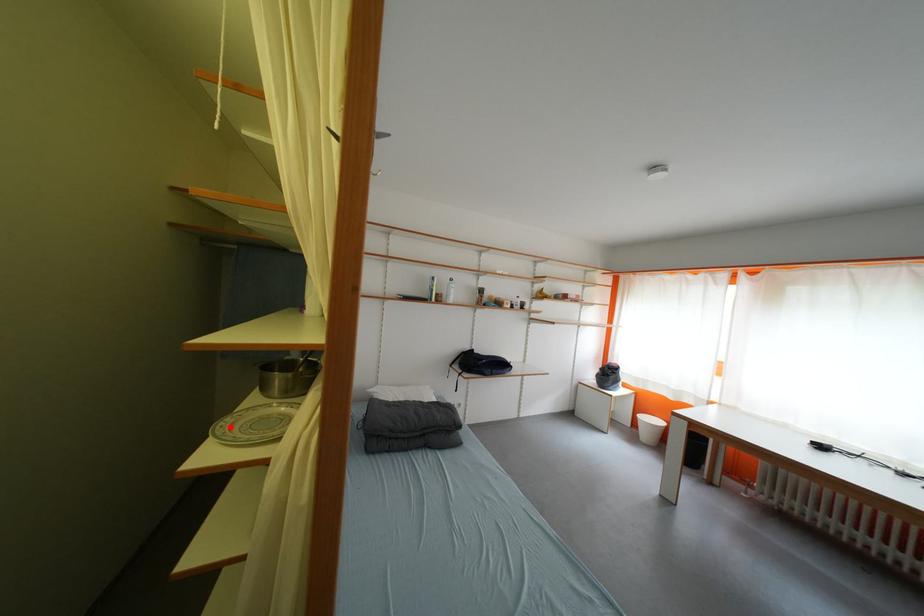
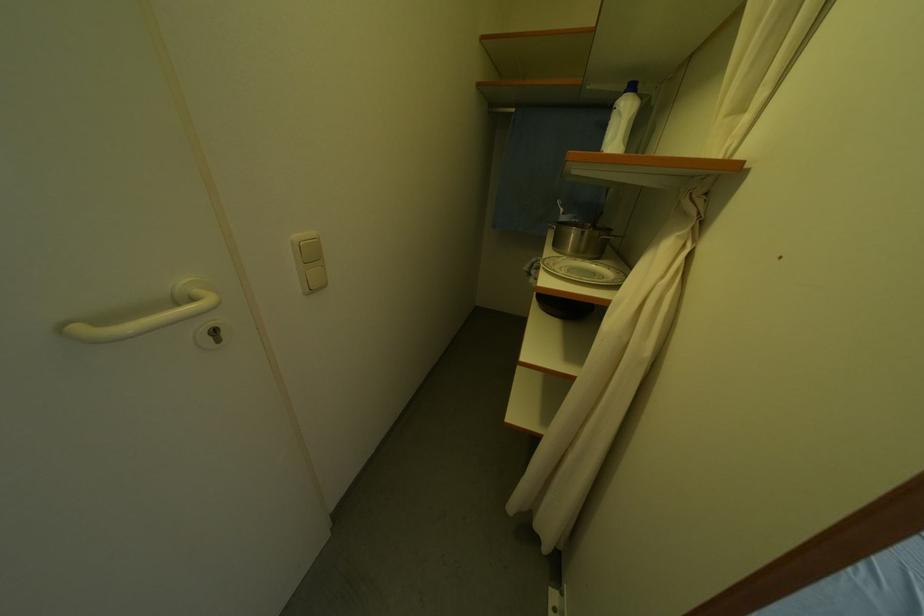
In the second image, find the point that corresponds to the highlighted location in the first image.

(554, 265)